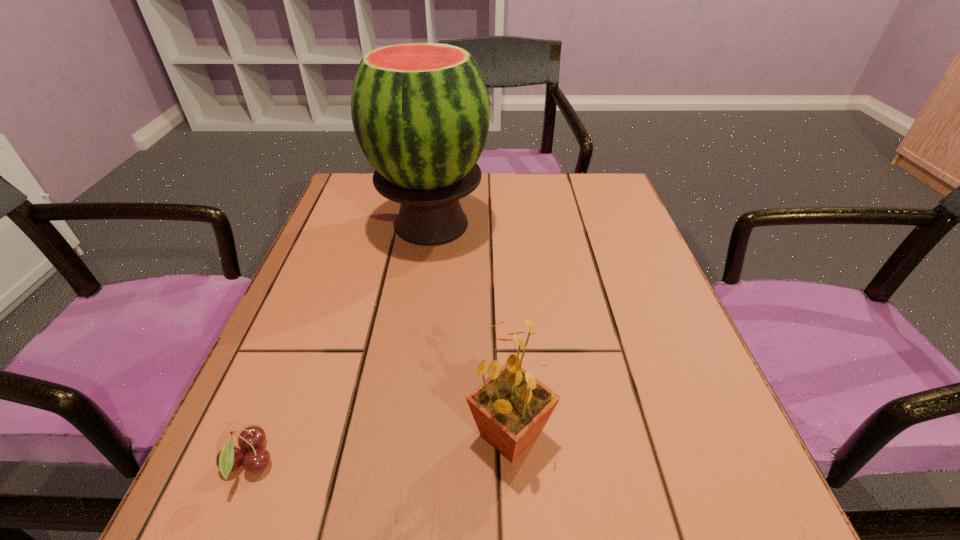
Image resolution: width=960 pixels, height=540 pixels. Identify the location of vacant space at the right edge. (621, 265).

In the image, there is a desktop. What are the coordinates of `vacant space at the far left corner` in the screenshot? It's located at (361, 182).

Locate an element on the screen. The height and width of the screenshot is (540, 960). vacant space at the far right corner is located at coordinates click(x=589, y=197).

The width and height of the screenshot is (960, 540). What are the coordinates of `free point between the shortest object and the sunflower` in the screenshot? It's located at (380, 448).

Where is `free spot between the sunflower and the cherry`? The width and height of the screenshot is (960, 540). free spot between the sunflower and the cherry is located at coordinates (380, 448).

This screenshot has height=540, width=960. In order to click on vacant area that lies between the shortest object and the farthest object in this screenshot , I will do `click(340, 343)`.

Where is `vacant region between the shortest object and the second shortest object`? This screenshot has width=960, height=540. vacant region between the shortest object and the second shortest object is located at coordinates (380, 448).

Where is `vacant space that's between the farthest object and the cherry`? vacant space that's between the farthest object and the cherry is located at coordinates (340, 343).

This screenshot has height=540, width=960. Find the location of `unoccupied area between the farthest object and the sunflower`. unoccupied area between the farthest object and the sunflower is located at coordinates (470, 329).

The width and height of the screenshot is (960, 540). What are the coordinates of `vacant area that lies between the farthest object and the second tallest object` in the screenshot? It's located at (470, 329).